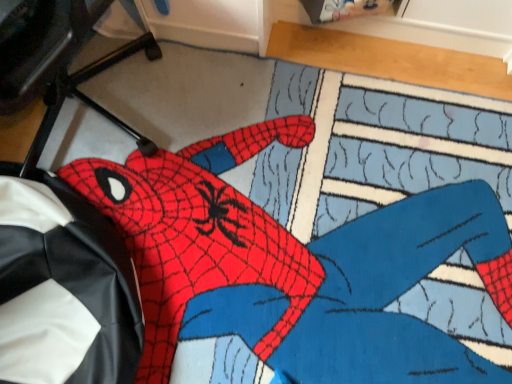
Question: Is black leather bean bag chair at left bigger or smaller than red matte spider-man figure at center?

Choices:
 (A) big
 (B) small

Answer: (A)

Question: Considering the positions of black leather bean bag chair at left and red matte spider-man figure at center in the image, is black leather bean bag chair at left wider or thinner than red matte spider-man figure at center?

Choices:
 (A) thin
 (B) wide

Answer: (A)

Question: Estimate the real-world distances between objects in this image. Which object is closer to the black leather computer chair at lower left?

Choices:
 (A) black leather bean bag chair at left
 (B) red matte spider-man figure at center

Answer: (A)

Question: Estimate the real-world distances between objects in this image. Which object is farther from the black leather computer chair at lower left?

Choices:
 (A) black leather bean bag chair at left
 (B) red matte spider-man figure at center

Answer: (B)